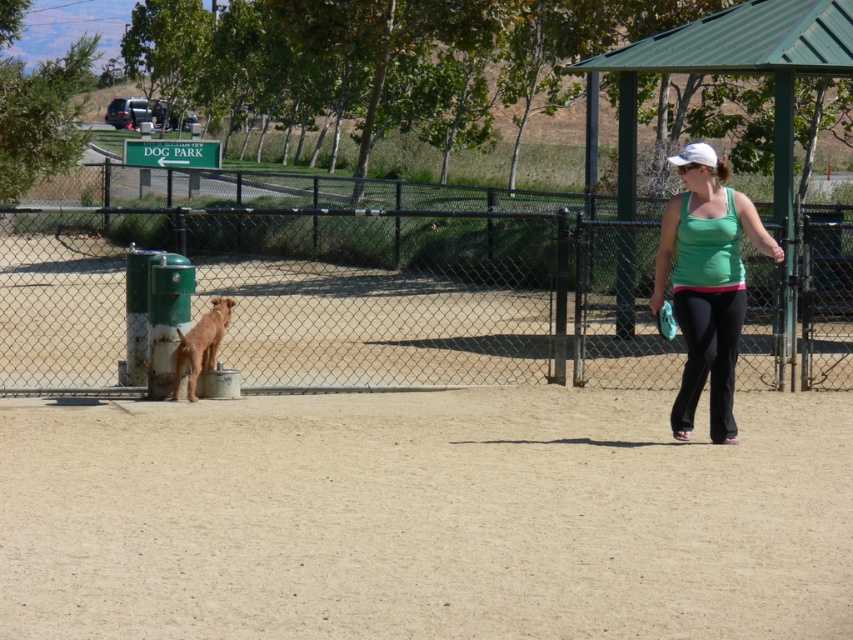
Question: Which point appears closest to the camera in this image?

Choices:
 (A) (222, 636)
 (B) (177, 349)
 (C) (608, 289)
 (D) (706, 353)

Answer: (A)

Question: Which of the following is the closest to the observer?

Choices:
 (A) green chain-link fence at center
 (B) brown sandy dirt at center

Answer: (B)

Question: Observing the image, what is the correct spatial positioning of green chain-link fence at center in reference to green fabric tank top at right?

Choices:
 (A) above
 (B) below

Answer: (A)

Question: Does brown sandy dirt at center appear under green chain-link fence at center?

Choices:
 (A) no
 (B) yes

Answer: (B)

Question: Which object is positioned farthest from the brown sandy dirt at center?

Choices:
 (A) green fabric tank top at right
 (B) green chain-link fence at center
 (C) brown fur dog at center

Answer: (B)

Question: Does brown sandy dirt at center have a lesser width compared to green fabric tank top at right?

Choices:
 (A) no
 (B) yes

Answer: (A)